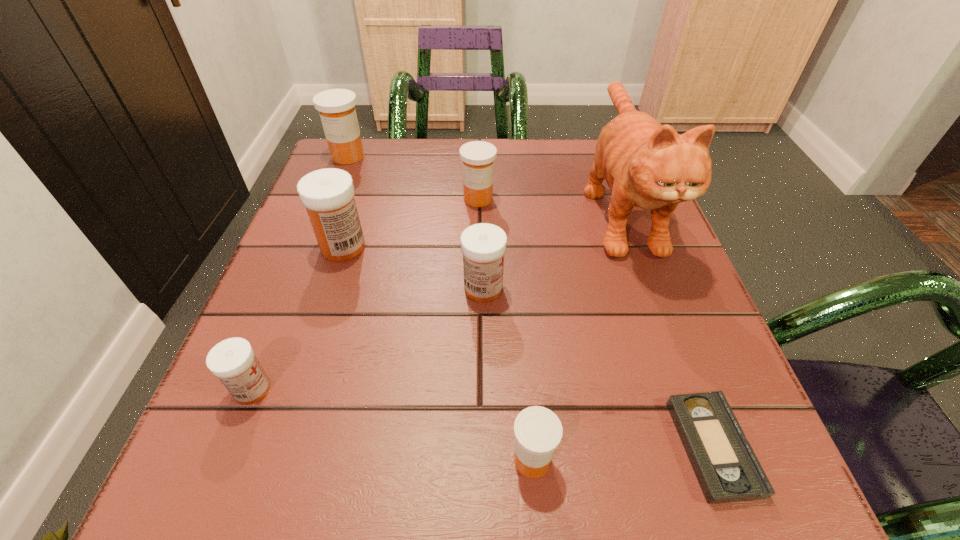
At what (x,y) coordinates should I click in order to perform the action: click on ginger cat. Please return your answer as a coordinate pair (x, y). The image size is (960, 540). Looking at the image, I should click on (647, 165).

You are a GUI agent. You are given a task and a screenshot of the screen. Output one action in this format:
    pyautogui.click(x=<x>, y=<y>)
    Task: Click on the cat
    Image resolution: width=960 pixels, height=540 pixels.
    Given the screenshot: What is the action you would take?
    pyautogui.click(x=647, y=165)

Find the location of `the leftmost orange medicine`. the leftmost orange medicine is located at coordinates (336, 107).

Find the location of a particular element. Image resolution: width=960 pixels, height=540 pixels. the biggest orange medicine is located at coordinates (336, 107).

The width and height of the screenshot is (960, 540). In order to click on the biggest white medicine in this screenshot , I will do `click(328, 194)`.

This screenshot has height=540, width=960. Identify the location of the third farthest medicine. (328, 194).

Identify the location of the second orange medicine from left to right. (477, 157).

This screenshot has height=540, width=960. What are the coordinates of `the second farthest orange medicine` in the screenshot? It's located at 477,157.

Where is `the rightmost white medicine`? the rightmost white medicine is located at coordinates (483, 245).

Locate an element on the screen. This screenshot has width=960, height=540. the fourth farthest medicine is located at coordinates (483, 245).